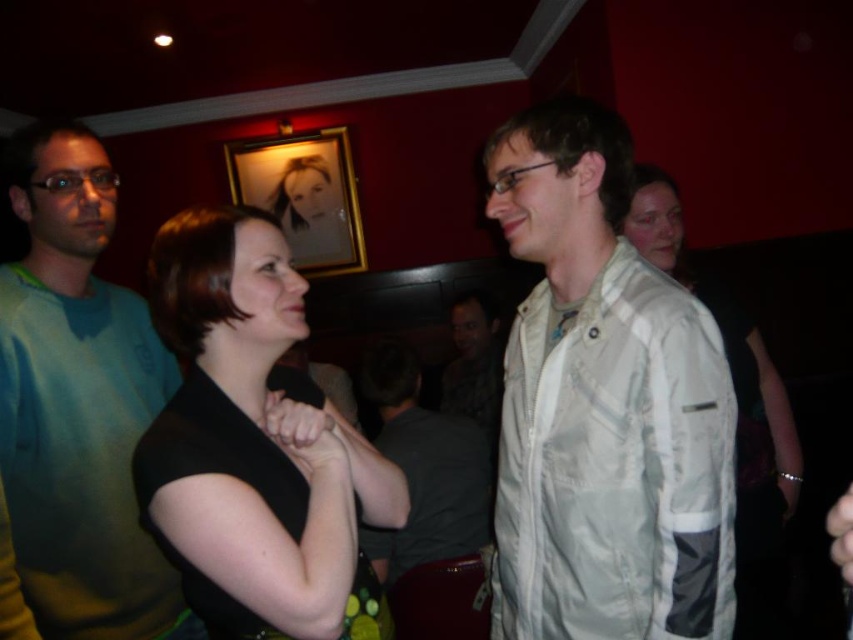
Consider the image. You are at a party and want to hang a picture on the wall between the light gray fabric jacket at center and the teal fleece sweater at left. Which object should you place the picture closer to if you want it to be higher up?

The light gray fabric jacket at center is much taller than the teal fleece sweater at left, so placing the picture closer to the light gray fabric jacket at center would position it higher up.

You are standing at the entrance of the bar and want to locate the person wearing the light beige fabric shirt at center. According to the coordinates provided, in which direction should you look to find them?

The light beige fabric shirt at center is located at coordinates point (428, 502), so you should look towards the center right area of the image to find them.

Based on the scene description, where is the light gray fabric jacket at center located in terms of its 2D coordinates?

The light gray fabric jacket at center is located at the 2D coordinates point (x=602, y=404).